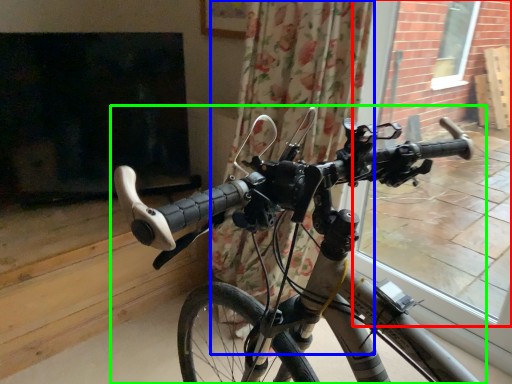
Question: Based on their relative distances, which object is nearer to window frame (highlighted by a red box)? Choose from curtain (highlighted by a blue box) and bicycle (highlighted by a green box).

Choices:
 (A) curtain
 (B) bicycle

Answer: (A)